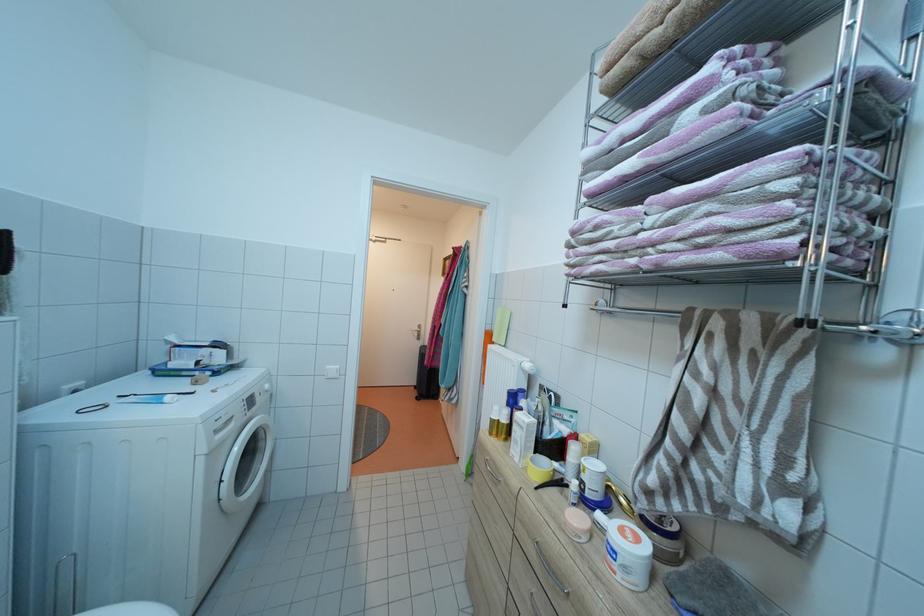
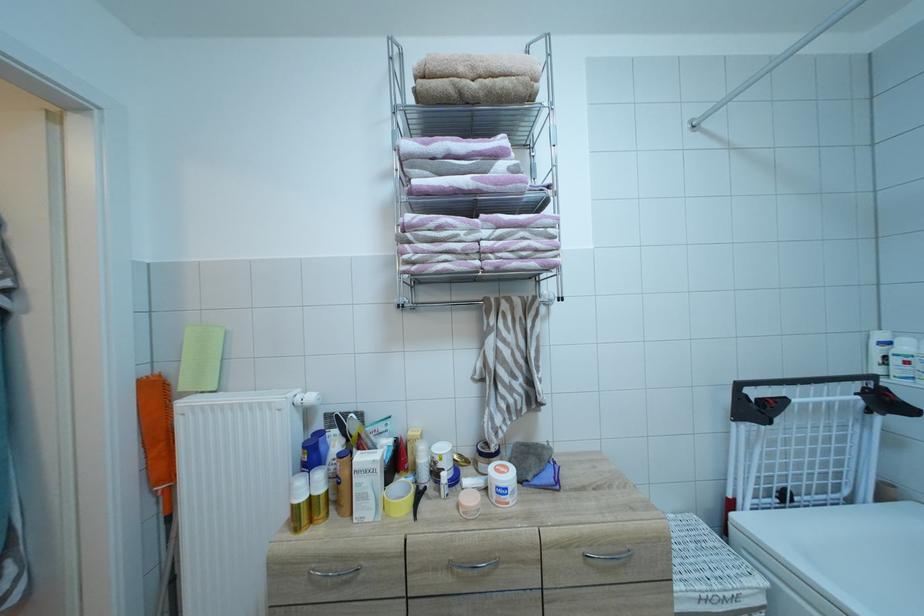
Question: The images are taken continuously from a first-person perspective. In which direction is your viewpoint rotating?

Choices:
 (A) Left
 (B) Right
 (C) Up
 (D) Down

Answer: (B)